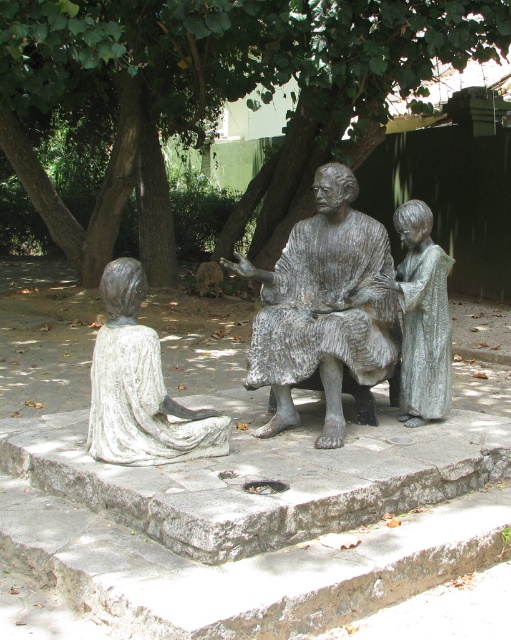
You are an art curator planning to move the bronze textured figure at center closer to the white marble statue at lower left. How much closer do you need to move it to reach the statue?

The bronze textured figure at center is currently 33.85 inches away from the white marble statue at lower left. To move it closer, you would need to reduce this distance by 33.85 inches to reach the statue.

You are a visitor at the sculpture garden and want to take a photo of the white marble statue at lower left without any obstruction. Since the green leafy tree at center is blocking your view, where should you move to get an unobstructed view?

You should move to a position behind the white marble statue at lower left so that the green leafy tree at center is no longer blocking your view.

You are an art student analyzing the sculpture composition. You notice the bronze textured figure at center and the white marble statue at lower left. Which of these two figures is taller?

The bronze textured figure at center is taller than the white marble statue at lower left.